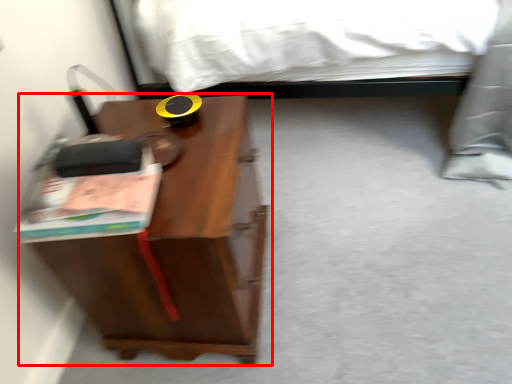
Question: From the image, what is the correct spatial relationship of nightstand (annotated by the red box) in relation to paperback book?

Choices:
 (A) right
 (B) left

Answer: (A)